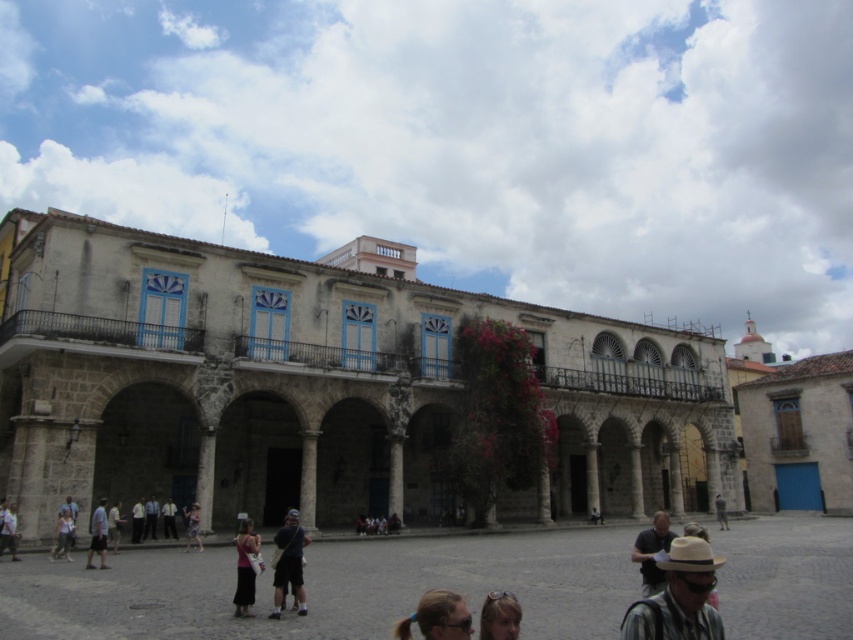
Question: Does dark gray fabric backpack at center have a greater width compared to dark gray pants at lower left?

Choices:
 (A) yes
 (B) no

Answer: (A)

Question: Does stone building at center have a smaller size compared to pink fabric dress at center?

Choices:
 (A) no
 (B) yes

Answer: (A)

Question: Which of these objects is positioned farthest from the light brown straw hat at lower right?

Choices:
 (A) denim skirt at center
 (B) stone building at center
 (C) brown stone courtyard at center
 (D) denim skirt at lower left

Answer: (D)

Question: Considering the real-world distances, which object is closest to the blonde hair at lower center?

Choices:
 (A) light brown straw hat at lower right
 (B) pink fabric dress at center
 (C) denim skirt at lower left

Answer: (A)

Question: Does pink fabric dress at center appear over denim skirt at lower left?

Choices:
 (A) no
 (B) yes

Answer: (A)

Question: Which object appears closest to the camera in this image?

Choices:
 (A) denim skirt at lower left
 (B) light brown straw hat at lower right
 (C) brown stone courtyard at center
 (D) blonde hair at lower center

Answer: (B)